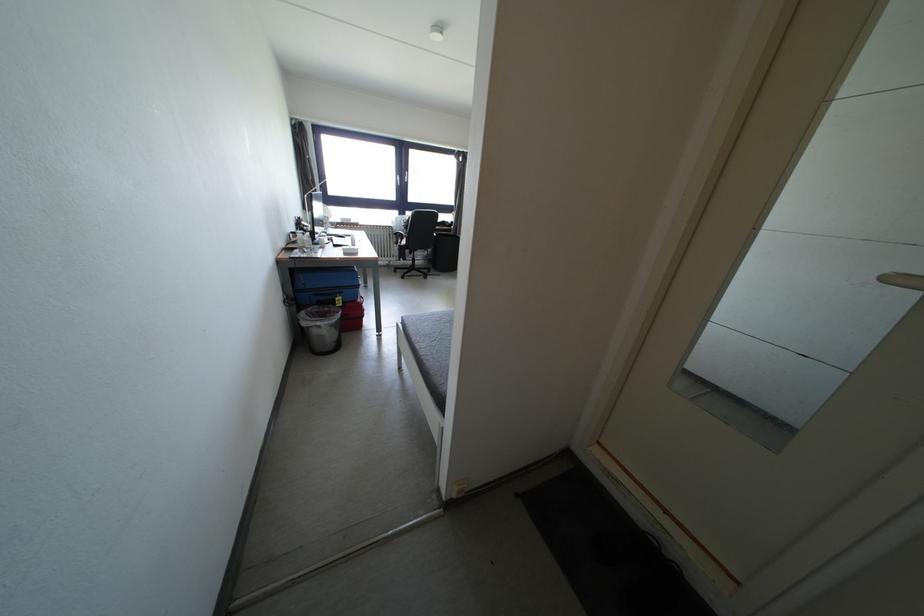
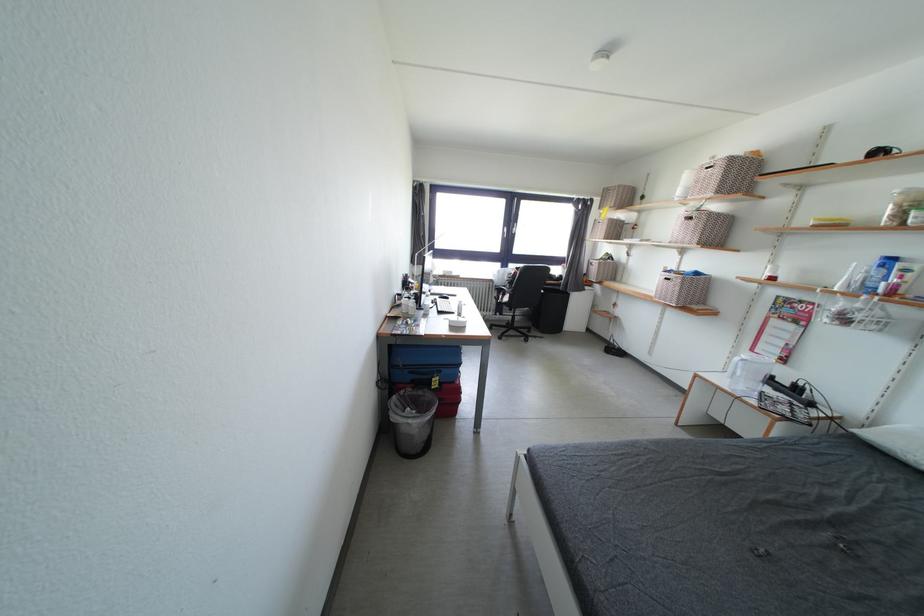
The point at (x=344, y=302) is marked in the first image. Where is the corresponding point in the second image?

(440, 384)